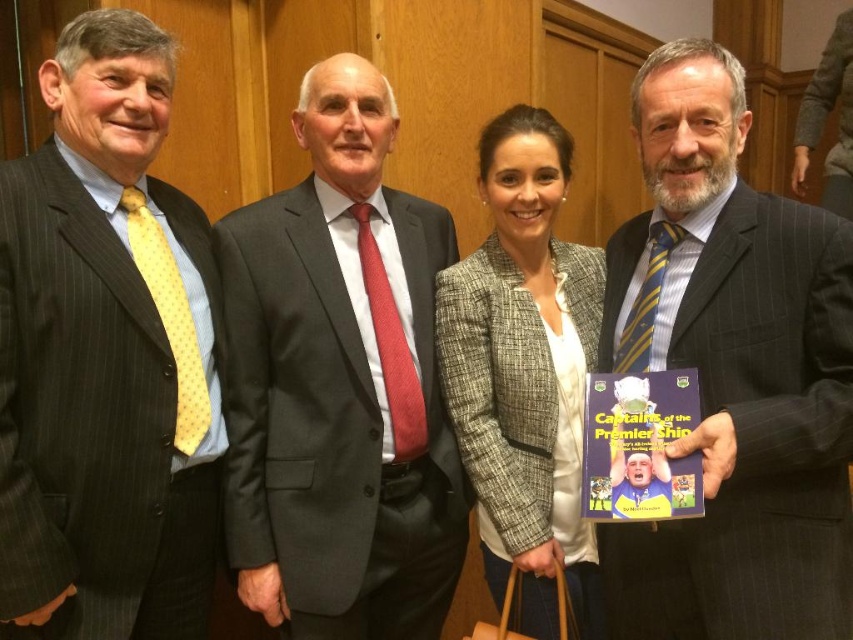
Consider the image. You are organizing a charity event and need to arrange two suits on a narrow display rack. The rack can only accommodate suits with a maximum width of 30 cm. You have the matte black suit at left and the dark gray suit at center. Which of these suits would fit better on the rack based on their widths?

The matte black suit at left is thinner than the dark gray suit at center, so it would fit better on the narrow display rack since it has a smaller width.

You are attending a formal event and notice two men wearing suits. The first man is wearing a striped wool suit at center, and the second man is wearing a dark gray suit at center. Which suit is shorter in length?

The striped wool suit at center is shorter than the dark gray suit at center.

You are organizing a charity event and need to seat guests based on their clothing. You have two guests wearing the matte black suit at left and the striped wool suit at center. Which guest should you seat first if you are following a rule that requires wider guests to be seated before narrower ones?

The striped wool suit at center should be seated first because its width is greater than the matte black suit at left.